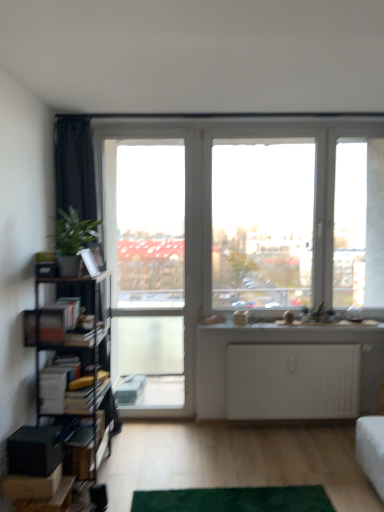
Find the location of a particular element. free space above clear glass screen door at center (from a real-world perspective) is located at coordinates (157, 128).